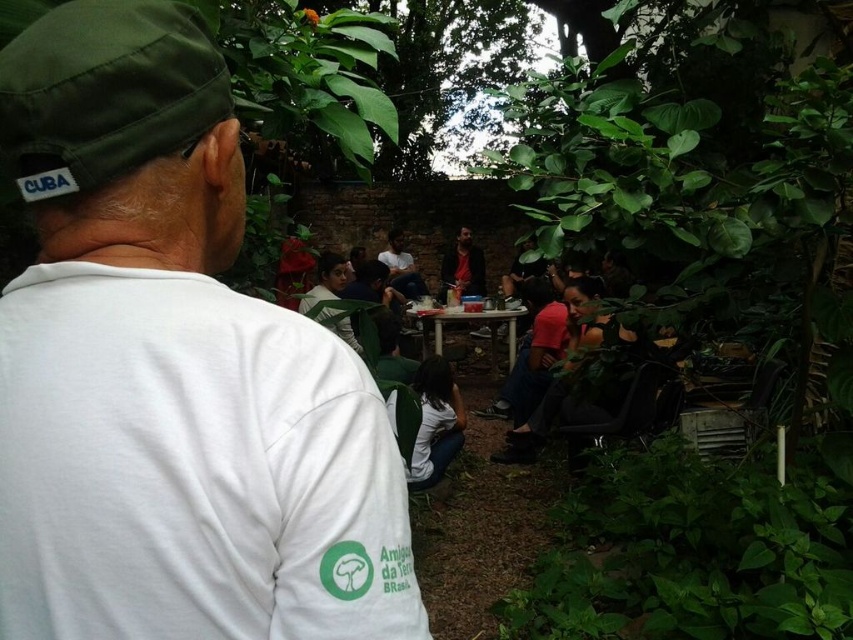
Question: Is white matte shirt at center in front of white glossy table at center?

Choices:
 (A) no
 (B) yes

Answer: (B)

Question: Which point is farther to the camera?

Choices:
 (A) dark brown leather jacket at center
 (B) white matte shirt at center
 (C) white glossy table at center

Answer: (A)

Question: Is white glossy table at center further to camera compared to dark brown leather jacket at center?

Choices:
 (A) no
 (B) yes

Answer: (A)

Question: Which point appears closest to the camera in this image?

Choices:
 (A) (480, 321)
 (B) (61, 132)
 (C) (454, 282)

Answer: (B)

Question: From the image, what is the correct spatial relationship of white glossy table at center in relation to dark brown leather jacket at center?

Choices:
 (A) right
 (B) left

Answer: (B)

Question: Among these points, which one is nearest to the camera?

Choices:
 (A) (508, 320)
 (B) (468, 227)
 (C) (71, 33)

Answer: (C)